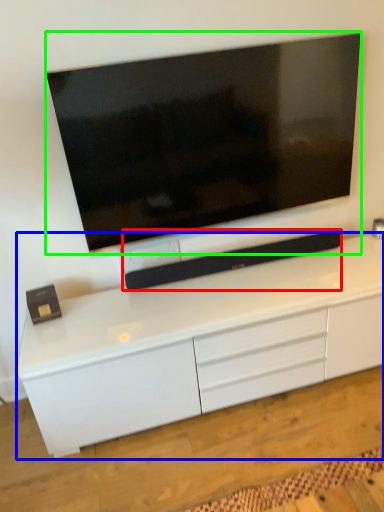
Question: Considering the real-world distances, which object is closest to equipment (highlighted by a red box)? cabinetry (highlighted by a blue box) or television (highlighted by a green box).

Choices:
 (A) cabinetry
 (B) television

Answer: (A)